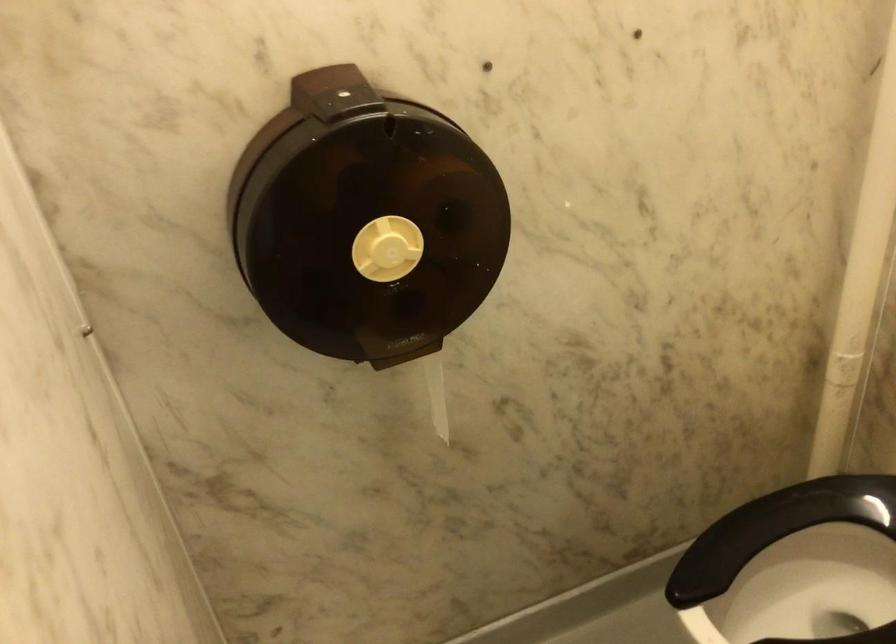
Describe the element at coordinates (780, 536) in the screenshot. This screenshot has width=896, height=644. I see `the black toilet seat` at that location.